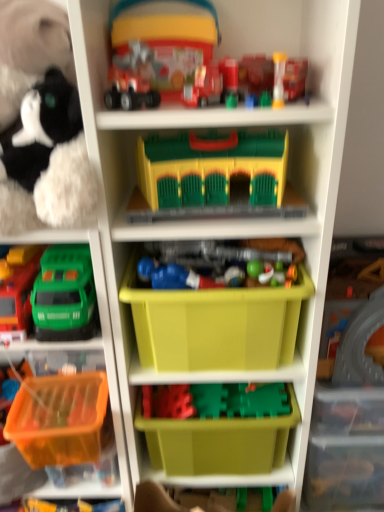
Where is `green plastic storage box at lower center, arranged as the second storage box when viewed from the top`? The width and height of the screenshot is (384, 512). green plastic storage box at lower center, arranged as the second storage box when viewed from the top is located at coordinates (218, 442).

How much space does green plastic storage box at lower center, arranged as the second storage box when viewed from the top, occupy horizontally?

green plastic storage box at lower center, arranged as the second storage box when viewed from the top, is 10.23 inches in width.

Image resolution: width=384 pixels, height=512 pixels. Describe the element at coordinates (59, 419) in the screenshot. I see `translucent orange plastic basket at lower left, acting as the third storage box starting from the top` at that location.

Consider the image. In order to face matte plastic train at center, placed as the 6th toy when sorted from top to bottom, should I rotate leftwards or rightwards?

A 3.092 degree turn to the right will do.

Identify the location of translucent orange plastic container at lower left, positioned as the ninth toy in top-to-bottom order. (10, 390).

Where is `green plastic toy truck at left, the 2th toy ordered from the bottom`? This screenshot has width=384, height=512. green plastic toy truck at left, the 2th toy ordered from the bottom is located at coordinates (50, 295).

At what (x,y) coordinates should I click in order to perform the action: click on green plastic storage box at lower center, arranged as the second storage box when viewed from the top. Please return your answer as a coordinate pair (x, y). Image resolution: width=384 pixels, height=512 pixels. Looking at the image, I should click on (218, 442).

From the image's perspective, between translucent plastic cup at upper center, which is the fourth toy in top-to-bottom order, and blue plastic toy at center, the seventh toy viewed from the top, who is located below?

From the image's view, blue plastic toy at center, the seventh toy viewed from the top, is below.

Is translucent plastic cup at upper center, which is the fourth toy in top-to-bottom order, to the right of blue plastic toy at center, the seventh toy viewed from the top, from the viewer's perspective?

Correct, you'll find translucent plastic cup at upper center, which is the fourth toy in top-to-bottom order, to the right of blue plastic toy at center, the seventh toy viewed from the top.

How many degrees apart are the facing directions of translucent plastic cup at upper center, which is counted as the 6th toy, starting from the bottom, and blue plastic toy at center, positioned as the third toy in bottom-to-top order?

The angle between the facing direction of translucent plastic cup at upper center, which is counted as the 6th toy, starting from the bottom, and the facing direction of blue plastic toy at center, positioned as the third toy in bottom-to-top order, is 0.00298 degrees.

Can you confirm if translucent plastic cup at upper center, which is counted as the 6th toy, starting from the bottom, is wider than blue plastic toy at center, positioned as the third toy in bottom-to-top order?

No, translucent plastic cup at upper center, which is counted as the 6th toy, starting from the bottom, is not wider than blue plastic toy at center, positioned as the third toy in bottom-to-top order.

Consider the image. Can you confirm if fluffy plush toy at left, the fifth toy when ordered from bottom to top, is taller than translucent plastic toy at upper center, placed as the 2th toy when sorted from top to bottom?

Indeed, fluffy plush toy at left, the fifth toy when ordered from bottom to top, has a greater height compared to translucent plastic toy at upper center, placed as the 2th toy when sorted from top to bottom.

Can we say fluffy plush toy at left, which is the 5th toy in top-to-bottom order, lies outside translucent plastic toy at upper center, placed as the 2th toy when sorted from top to bottom?

Yes, fluffy plush toy at left, which is the 5th toy in top-to-bottom order, is not within translucent plastic toy at upper center, placed as the 2th toy when sorted from top to bottom.

From the picture: Between fluffy plush toy at left, which is the 5th toy in top-to-bottom order, and translucent plastic toy at upper center, placed as the 2th toy when sorted from top to bottom, which one has larger size?

fluffy plush toy at left, which is the 5th toy in top-to-bottom order.

Is there a large distance between fluffy plush toy at left, the fifth toy when ordered from bottom to top, and translucent plastic toy at upper center, placed as the 2th toy when sorted from top to bottom?

They are positioned close to each other.

Consider the image. Is green plastic storage box at lower center, arranged as the second storage box when viewed from the top, not near translucent orange plastic container at lower left, positioned as the ninth toy in top-to-bottom order?

green plastic storage box at lower center, arranged as the second storage box when viewed from the top, is actually quite close to translucent orange plastic container at lower left, positioned as the ninth toy in top-to-bottom order.

Can you confirm if green plastic storage box at lower center, arranged as the second storage box when viewed from the top, is thinner than translucent orange plastic container at lower left, positioned as the ninth toy in top-to-bottom order?

No.

Consider the image. Is green plastic storage box at lower center, which is the 2th storage box in bottom-to-top order, shorter than translucent orange plastic container at lower left, positioned as the ninth toy in top-to-bottom order?

No.

Does green plastic storage box at lower center, arranged as the second storage box when viewed from the top, turn towards translucent orange plastic container at lower left, marked as the first toy in a bottom-to-top arrangement?

No, green plastic storage box at lower center, arranged as the second storage box when viewed from the top, is not facing towards translucent orange plastic container at lower left, marked as the first toy in a bottom-to-top arrangement.

Does matte plastic toy car at upper center, acting as the seventh toy starting from the bottom, have a smaller size compared to green plastic storage box at lower center, which is the 2th storage box in bottom-to-top order?

Indeed, matte plastic toy car at upper center, acting as the seventh toy starting from the bottom, has a smaller size compared to green plastic storage box at lower center, which is the 2th storage box in bottom-to-top order.

Considering the points (150, 101) and (282, 433), which point is behind, point (150, 101) or point (282, 433)?

The point (282, 433) is behind.

Does matte plastic toy car at upper center, which is counted as the 3th toy, starting from the top, touch green plastic storage box at lower center, arranged as the second storage box when viewed from the top?

No, matte plastic toy car at upper center, which is counted as the 3th toy, starting from the top, is not with green plastic storage box at lower center, arranged as the second storage box when viewed from the top.

Which is more to the right, matte plastic toy car at upper center, acting as the seventh toy starting from the bottom, or fluffy plush toy at left, which is the 5th toy in top-to-bottom order?

matte plastic toy car at upper center, acting as the seventh toy starting from the bottom, is more to the right.

Is point (117, 55) closer or farther from the camera than point (14, 178)?

Clearly, point (117, 55) is more distant from the camera than point (14, 178).

Is matte plastic toy car at upper center, which is counted as the 3th toy, starting from the top, turned away from fluffy plush toy at left, the fifth toy when ordered from bottom to top?

matte plastic toy car at upper center, which is counted as the 3th toy, starting from the top, is not turned away from fluffy plush toy at left, the fifth toy when ordered from bottom to top.

At what (x,y) coordinates should I click in order to perform the action: click on toy in front of the fluffy plush toy at left, which is the 5th toy in top-to-bottom order. Please return your answer as a coordinate pair (x, y). Image resolution: width=384 pixels, height=512 pixels. Looking at the image, I should click on (132, 80).

From the image's perspective, would you say translucent plastic cup at upper center, which is counted as the 6th toy, starting from the bottom, is shown under translucent plastic toy at upper center, placed as the 2th toy when sorted from top to bottom?

Indeed, from the image's perspective, translucent plastic cup at upper center, which is counted as the 6th toy, starting from the bottom, is shown beneath translucent plastic toy at upper center, placed as the 2th toy when sorted from top to bottom.

Looking at this image, do you think translucent plastic cup at upper center, which is counted as the 6th toy, starting from the bottom, is within translucent plastic toy at upper center, placed as the 2th toy when sorted from top to bottom, or outside of it?

translucent plastic cup at upper center, which is counted as the 6th toy, starting from the bottom, cannot be found inside translucent plastic toy at upper center, placed as the 2th toy when sorted from top to bottom.

Considering the relative positions of translucent plastic cup at upper center, which is counted as the 6th toy, starting from the bottom, and translucent plastic toy at upper center, which is the eighth toy from bottom to top, in the image provided, is translucent plastic cup at upper center, which is counted as the 6th toy, starting from the bottom, to the right of translucent plastic toy at upper center, which is the eighth toy from bottom to top, from the viewer's perspective?

Yes.

Image resolution: width=384 pixels, height=512 pixels. I want to click on toy that is the 1st one below the translucent plastic toy at upper center, placed as the 2th toy when sorted from top to bottom (from a real-world perspective), so click(278, 79).

Is matte plastic toy truck at upper center, which appears as the 1th toy when viewed from the top, turned away from translucent orange plastic basket at left?

No, matte plastic toy truck at upper center, which appears as the 1th toy when viewed from the top,'s orientation is not away from translucent orange plastic basket at left.

Is matte plastic toy truck at upper center, arranged as the 9th toy when ordered from the bottom, next to translucent orange plastic basket at left and touching it?

They are not placed beside each other.

Is point (206, 84) behind point (121, 462)?

No, it is in front of (121, 462).

Locate an element on the screen. the 2nd toy to the right of the blue plastic toy at center, positioned as the third toy in bottom-to-top order, counting from the anchor's position is located at coordinates point(278,79).

Where is `the 1st toy behind the fluffy plush toy at left, the fifth toy when ordered from bottom to top, counting from the anchor's position`? This screenshot has width=384, height=512. the 1st toy behind the fluffy plush toy at left, the fifth toy when ordered from bottom to top, counting from the anchor's position is located at coordinates (265, 75).

In the scene shown: Looking at the image, which one is located further to green plastic storage box at lower center, which is the 2th storage box in bottom-to-top order, fluffy plush toy at left, the fifth toy when ordered from bottom to top, or yellow plastic storage box at center, marked as the first storage box in a top-to-bottom arrangement?

fluffy plush toy at left, the fifth toy when ordered from bottom to top, is further to green plastic storage box at lower center, which is the 2th storage box in bottom-to-top order.

Which object lies further to the anchor point blue plastic toy at center, the seventh toy viewed from the top, translucent orange plastic basket at lower left, acting as the third storage box starting from the top, or yellow plastic storage box at center, arranged as the third storage box when ordered from the bottom?

Among the two, translucent orange plastic basket at lower left, acting as the third storage box starting from the top, is located further to blue plastic toy at center, the seventh toy viewed from the top.

From the image, which object appears to be nearer to green plastic toy truck at left, which is the eighth toy in top-to-bottom order, translucent orange plastic basket at left or fluffy plush toy at left, which is the 5th toy in top-to-bottom order?

translucent orange plastic basket at left is closer to green plastic toy truck at left, which is the eighth toy in top-to-bottom order.

Estimate the real-world distances between objects in this image. Which object is further from translucent plastic toy at upper center, placed as the 2th toy when sorted from top to bottom, yellow plastic storage box at center, arranged as the third storage box when ordered from the bottom, or translucent plastic cup at upper center, which is counted as the 6th toy, starting from the bottom?

The object further to translucent plastic toy at upper center, placed as the 2th toy when sorted from top to bottom, is yellow plastic storage box at center, arranged as the third storage box when ordered from the bottom.

Considering their positions, is translucent plastic toy at upper center, placed as the 2th toy when sorted from top to bottom, positioned further to translucent orange plastic basket at lower left, acting as the third storage box starting from the top, than green plastic toy truck at left, the 2th toy ordered from the bottom?

translucent plastic toy at upper center, placed as the 2th toy when sorted from top to bottom, lies further to translucent orange plastic basket at lower left, acting as the third storage box starting from the top, than the other object.

Estimate the real-world distances between objects in this image. Which object is further from translucent orange plastic basket at lower left, positioned as the first storage box in bottom-to-top order, translucent plastic cup at upper center, which is the fourth toy in top-to-bottom order, or green plastic storage box at lower center, arranged as the second storage box when viewed from the top?

Based on the image, translucent plastic cup at upper center, which is the fourth toy in top-to-bottom order, appears to be further to translucent orange plastic basket at lower left, positioned as the first storage box in bottom-to-top order.

When comparing their distances from green plastic toy truck at left, which is the eighth toy in top-to-bottom order, does matte plastic train at center, the fourth toy from the bottom, or translucent orange plastic container at lower left, marked as the first toy in a bottom-to-top arrangement, seem closer?

Among the two, matte plastic train at center, the fourth toy from the bottom, is located nearer to green plastic toy truck at left, which is the eighth toy in top-to-bottom order.

When comparing their distances from translucent plastic cup at upper center, which is the fourth toy in top-to-bottom order, does translucent orange plastic container at lower left, marked as the first toy in a bottom-to-top arrangement, or matte plastic toy truck at upper center, arranged as the 9th toy when ordered from the bottom, seem further?

translucent orange plastic container at lower left, marked as the first toy in a bottom-to-top arrangement.

What are the coordinates of `shelf between matte plastic toy car at upper center, acting as the seventh toy starting from the bottom, and translucent orange plastic container at lower left, marked as the first toy in a bottom-to-top arrangement, vertically` in the screenshot? It's located at (95, 340).

At what (x,y) coordinates should I click in order to perform the action: click on storage box between fluffy plush toy at left, which is the 5th toy in top-to-bottom order, and blue plastic toy at center, positioned as the third toy in bottom-to-top order. Please return your answer as a coordinate pair (x, y). Looking at the image, I should click on (214, 324).

Locate an element on the screen. The image size is (384, 512). storage box between fluffy plush toy at left, the fifth toy when ordered from bottom to top, and green plastic storage box at lower center, which is the 2th storage box in bottom-to-top order, vertically is located at coordinates (214, 324).

Where is `storage box between matte plastic toy truck at upper center, which appears as the 1th toy when viewed from the top, and green plastic storage box at lower center, arranged as the second storage box when viewed from the top, vertically`? Image resolution: width=384 pixels, height=512 pixels. storage box between matte plastic toy truck at upper center, which appears as the 1th toy when viewed from the top, and green plastic storage box at lower center, arranged as the second storage box when viewed from the top, vertically is located at coordinates (214, 324).